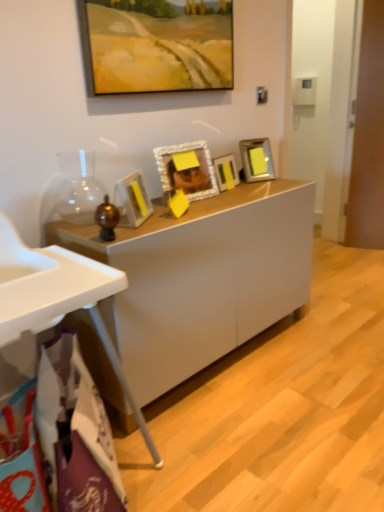
The height and width of the screenshot is (512, 384). Identify the location of vacant area to the right of metallic silver picture frame at center, which is the 3th picture frame from top to bottom. (271, 186).